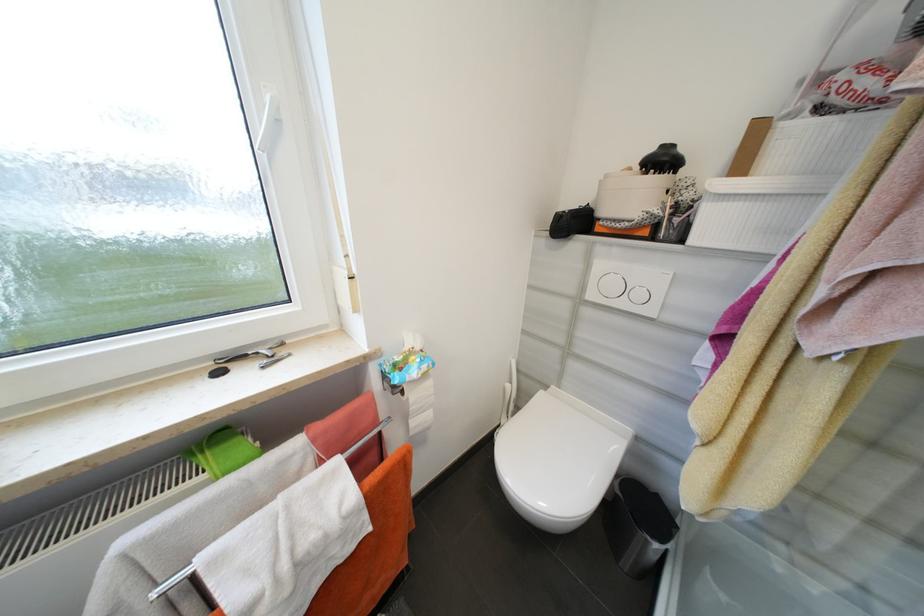
Which object does [572,222] point to?

It refers to a small black bag.